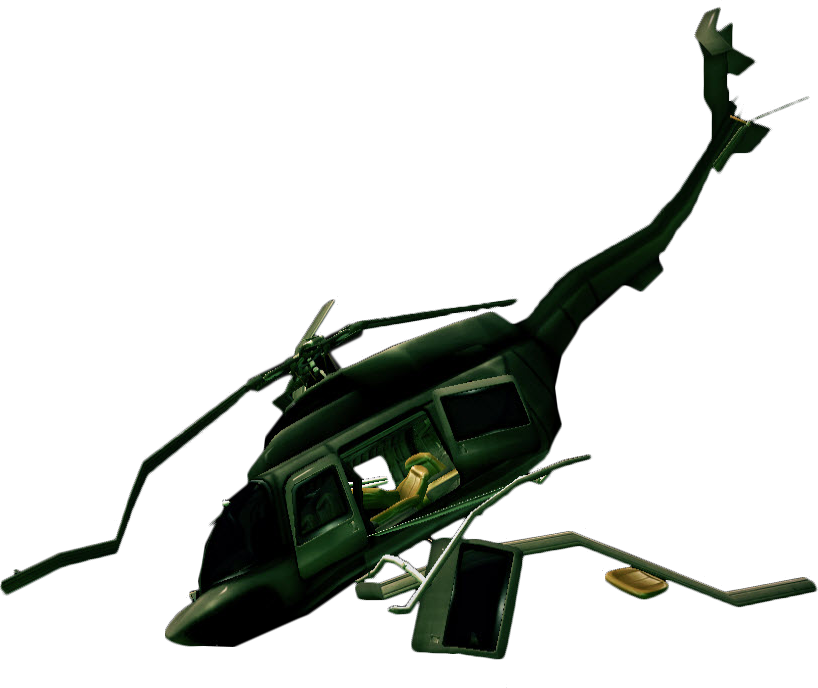
Identify the location of doorway. (376, 466), (397, 451).